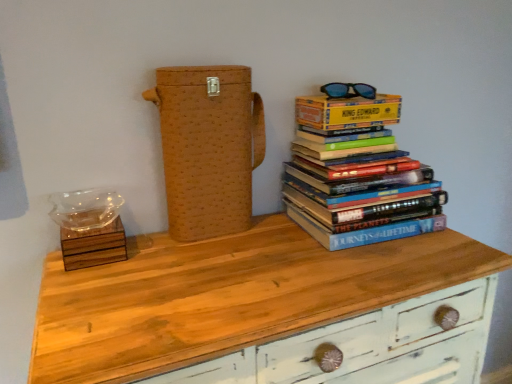
Question: Can we say brown woven box at center lies outside hardcover books at upper right?

Choices:
 (A) yes
 (B) no

Answer: (A)

Question: Is brown woven box at center behind hardcover books at upper right?

Choices:
 (A) yes
 (B) no

Answer: (B)

Question: Is brown woven box at center to the left of hardcover books at upper right from the viewer's perspective?

Choices:
 (A) no
 (B) yes

Answer: (B)

Question: Considering the relative sizes of brown woven box at center and hardcover books at upper right in the image provided, is brown woven box at center shorter than hardcover books at upper right?

Choices:
 (A) no
 (B) yes

Answer: (A)

Question: Can you confirm if brown woven box at center is bigger than hardcover books at upper right?

Choices:
 (A) yes
 (B) no

Answer: (B)

Question: Is brown woven box at center beside hardcover books at upper right?

Choices:
 (A) no
 (B) yes

Answer: (A)

Question: Is wooden chest of drawers at center behind brown woven box at center?

Choices:
 (A) no
 (B) yes

Answer: (A)

Question: Considering the relative positions of wooden chest of drawers at center and brown woven box at center in the image provided, is wooden chest of drawers at center to the left of brown woven box at center from the viewer's perspective?

Choices:
 (A) no
 (B) yes

Answer: (A)

Question: Is wooden chest of drawers at center to the right of brown woven box at center from the viewer's perspective?

Choices:
 (A) yes
 (B) no

Answer: (A)

Question: Are wooden chest of drawers at center and brown woven box at center located far from each other?

Choices:
 (A) no
 (B) yes

Answer: (A)

Question: Is wooden chest of drawers at center shorter than brown woven box at center?

Choices:
 (A) no
 (B) yes

Answer: (A)

Question: Does wooden chest of drawers at center have a larger size compared to brown woven box at center?

Choices:
 (A) yes
 (B) no

Answer: (A)

Question: Is yellow paper at upper right shorter than brown woven box at center?

Choices:
 (A) yes
 (B) no

Answer: (A)